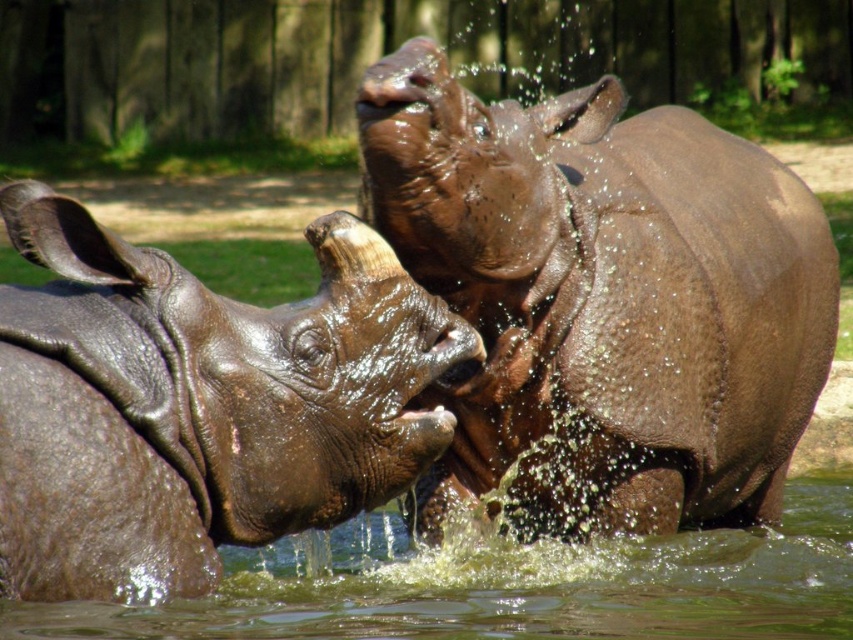
Question: Does glossy brown rhinoceros at center appear on the left side of clear water at rhino center?

Choices:
 (A) no
 (B) yes

Answer: (B)

Question: Is the position of wet brown rhinoceros at center less distant than that of glossy brown rhinoceros at center?

Choices:
 (A) no
 (B) yes

Answer: (A)

Question: Is wet brown rhinoceros at center to the left of glossy brown rhinoceros at center from the viewer's perspective?

Choices:
 (A) no
 (B) yes

Answer: (A)

Question: Which object is farther from the camera taking this photo?

Choices:
 (A) wet brown rhinoceros at center
 (B) glossy brown rhinoceros at center

Answer: (A)

Question: Estimate the real-world distances between objects in this image. Which object is farther from the glossy brown rhinoceros at center?

Choices:
 (A) wet brown rhinoceros at center
 (B) clear water at rhino center

Answer: (A)

Question: Estimate the real-world distances between objects in this image. Which object is farther from the glossy brown rhinoceros at center?

Choices:
 (A) wet brown rhinoceros at center
 (B) clear water at rhino center

Answer: (A)